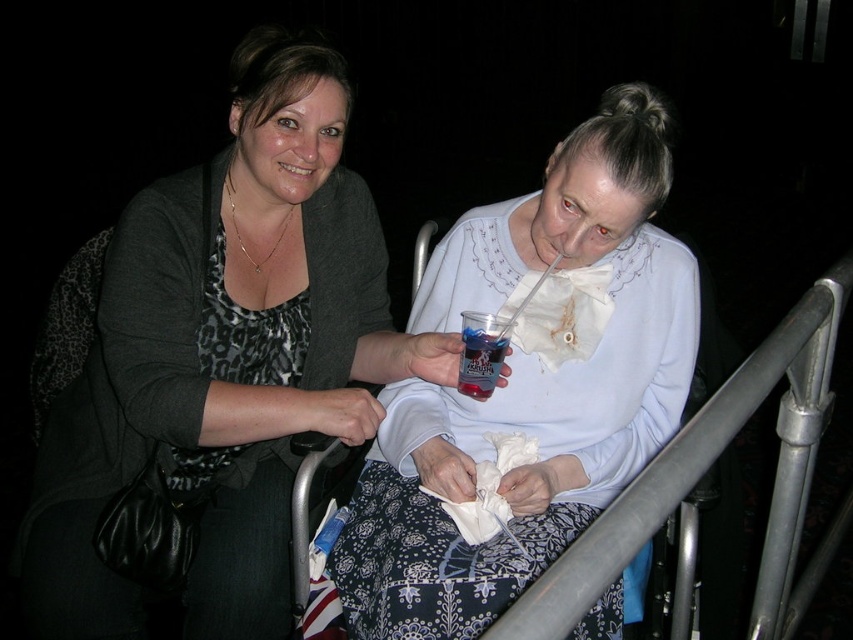
This screenshot has height=640, width=853. I want to click on white lace blouse at center, so [x=527, y=387].

Between white lace blouse at center and translucent plastic cup at center, which one appears on the right side from the viewer's perspective?

From the viewer's perspective, white lace blouse at center appears more on the right side.

You are a GUI agent. You are given a task and a screenshot of the screen. Output one action in this format:
    pyautogui.click(x=<x>, y=<y>)
    Task: Click on the white lace blouse at center
    
    Given the screenshot: What is the action you would take?
    pyautogui.click(x=527, y=387)

Is matte black sweater at center further to camera compared to white lace blouse at center?

Yes, it is behind white lace blouse at center.

Who is more forward, (x=299, y=209) or (x=563, y=330)?

Positioned in front is point (x=299, y=209).

Between point (306, 102) and point (675, 240), which one is positioned behind?

Point (675, 240)

I want to click on matte black sweater at center, so click(x=219, y=369).

Based on the photo, does matte black sweater at center have a lesser height compared to translucent plastic cup at center?

No.

Describe the element at coordinates (219, 369) in the screenshot. The height and width of the screenshot is (640, 853). I see `matte black sweater at center` at that location.

In order to click on matte black sweater at center in this screenshot , I will do `click(219, 369)`.